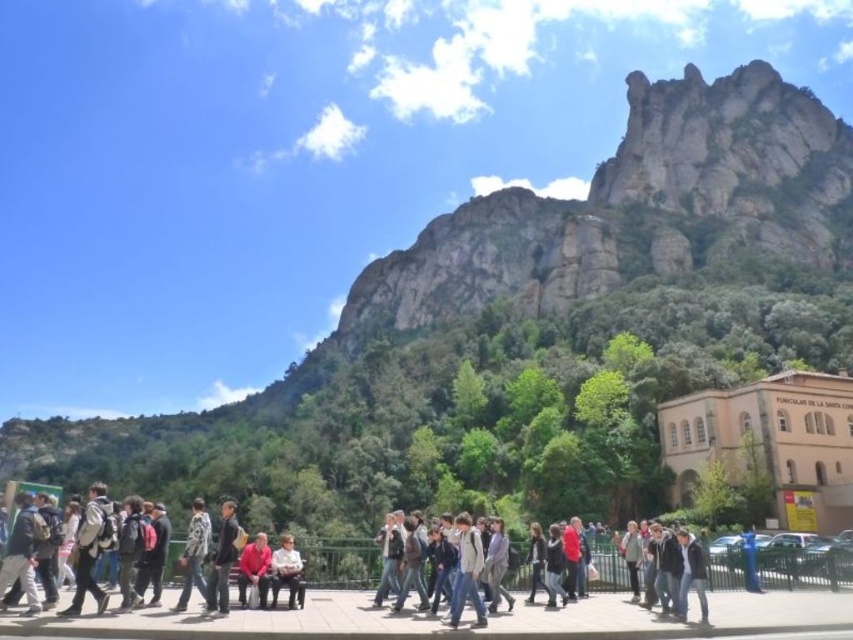
Question: Which object is the farthest from the light gray jacket at center?

Choices:
 (A) dark gray sweater at center
 (B) light brown leather jacket at center
 (C) matte red shirt at center

Answer: (C)

Question: Can you confirm if light gray jacket at center is smaller than dark gray sweater at center?

Choices:
 (A) no
 (B) yes

Answer: (B)

Question: Can you confirm if light gray jacket at center is positioned to the left of dark gray sweater at center?

Choices:
 (A) no
 (B) yes

Answer: (B)

Question: Which point appears closest to the camera in this image?

Choices:
 (A) click(x=543, y=561)
 (B) click(x=256, y=556)

Answer: (B)

Question: Which of the following is the closest to the observer?

Choices:
 (A) (498, 532)
 (B) (286, 557)
 (C) (543, 541)
 (D) (252, 557)

Answer: (D)

Question: Does matte red shirt at center have a larger size compared to dark gray sweater at center?

Choices:
 (A) yes
 (B) no

Answer: (A)